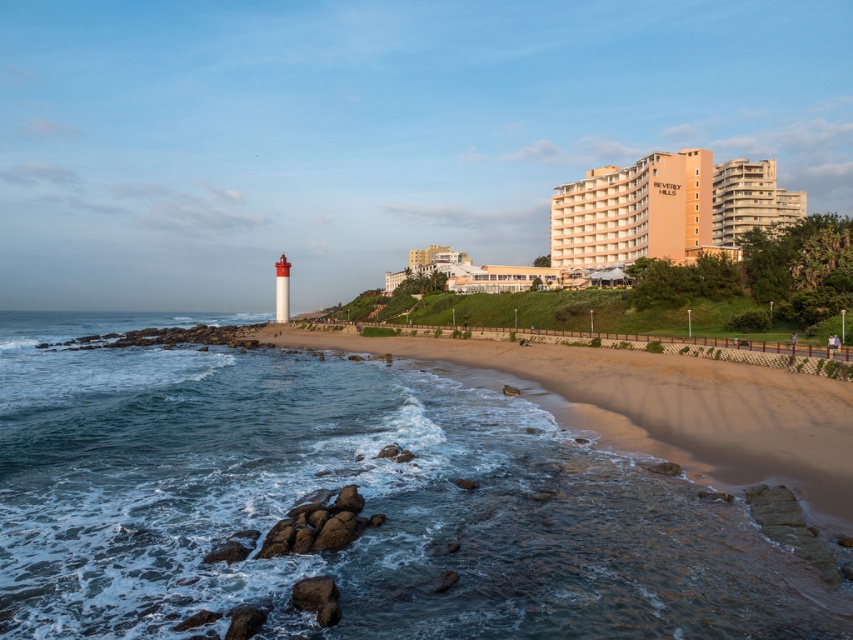
You are standing at the shoreline looking towards the beach. There are two points marked in the image. The first point is at coordinates point (370, 451) and the second is at point (804, 195). Which point is closer to you?

Point (370, 451) is closer to the viewer than point (804, 195).

You are standing at the origin point of the image coordinate system. Which direction should you move to reach the sandy beach at lower center?

The sandy beach at lower center is located at coordinates point [669,406], so you should move towards the lower center direction to reach it.